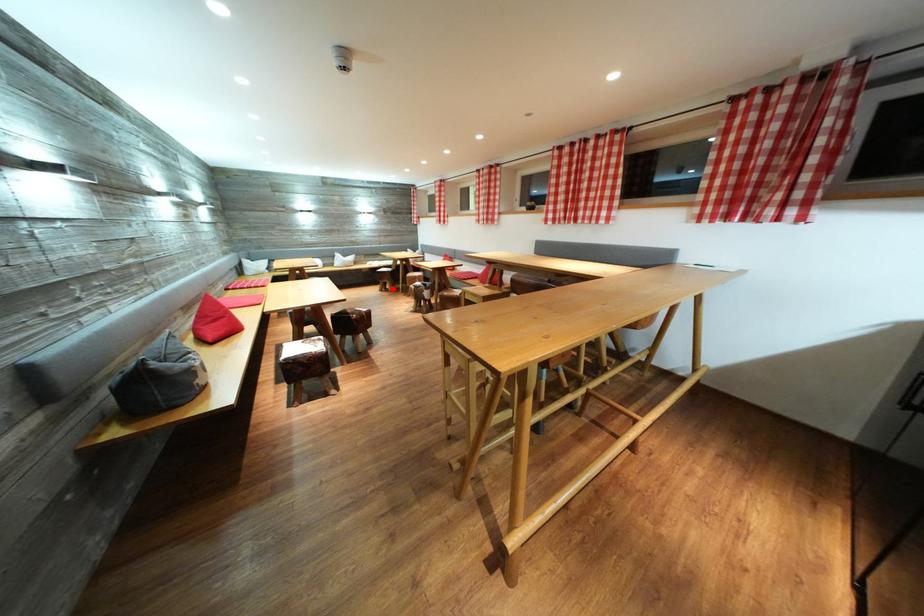
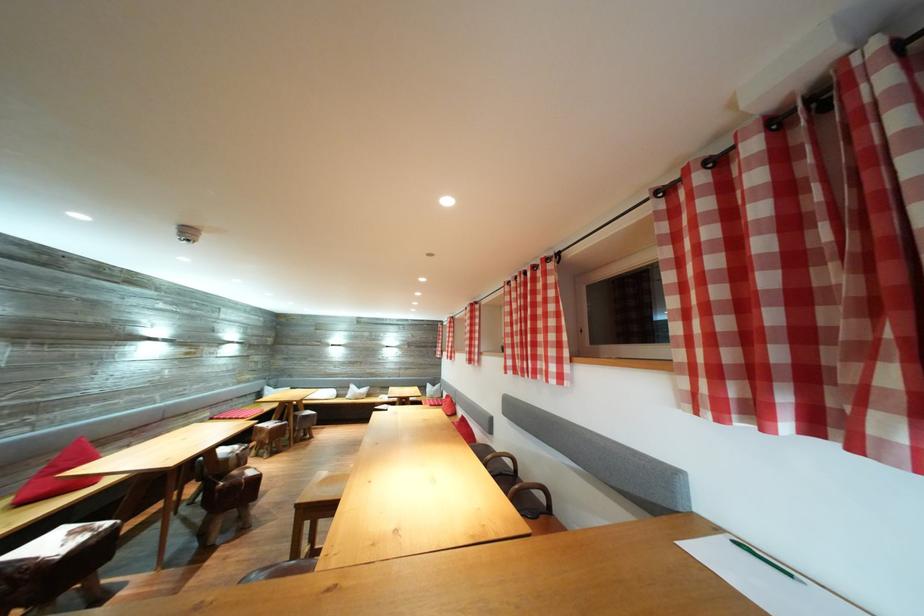
Question: I am providing you with two images of the same scene from different viewpoints. A red point is marked on the first image. Can you still see the location of the red point in image 2?

Choices:
 (A) Yes
 (B) No

Answer: (B)